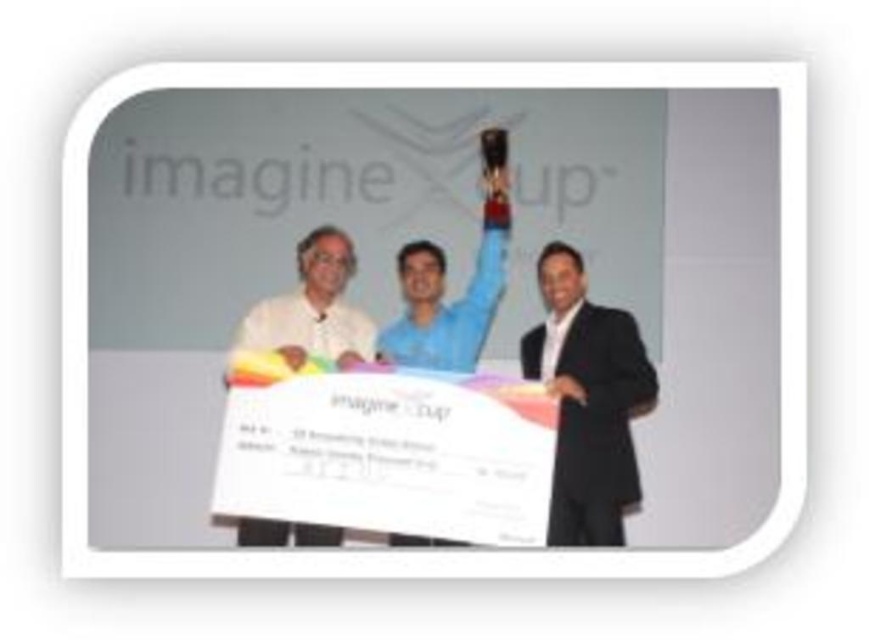
Where is `black suit at right`? black suit at right is located at coordinates (587, 401).

Who is lower down, black suit at right or white matte shirt at center?

black suit at right

Describe the element at coordinates (587, 401) in the screenshot. This screenshot has height=640, width=869. I see `black suit at right` at that location.

Identify the location of black suit at right. Image resolution: width=869 pixels, height=640 pixels. (587, 401).